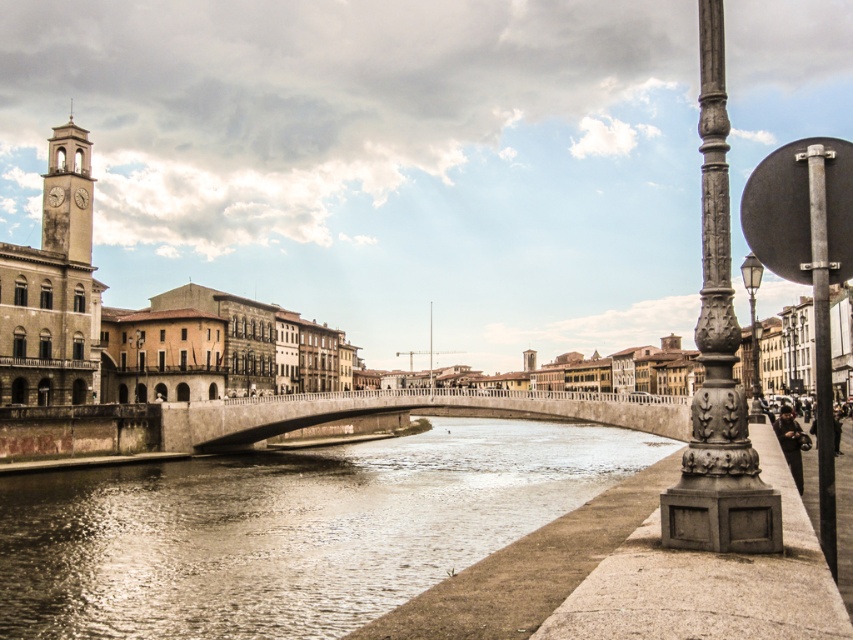
Is point (375, 516) positioned before point (605, 406)?

Yes, it is.

The width and height of the screenshot is (853, 640). I want to click on brown concrete river at center, so click(x=288, y=529).

Does dark gray ornate pole at right have a larger size compared to stone clock tower at upper left?

Yes.

Between dark gray ornate pole at right and stone clock tower at upper left, which one has less height?

Standing shorter between the two is stone clock tower at upper left.

Find the location of `dark gray ornate pole at right`. dark gray ornate pole at right is located at coordinates (717, 362).

This screenshot has height=640, width=853. Describe the element at coordinates (68, 193) in the screenshot. I see `stone clock tower at upper left` at that location.

This screenshot has width=853, height=640. I want to click on stone clock tower at upper left, so click(x=68, y=193).

Identify the location of stone clock tower at upper left. (68, 193).